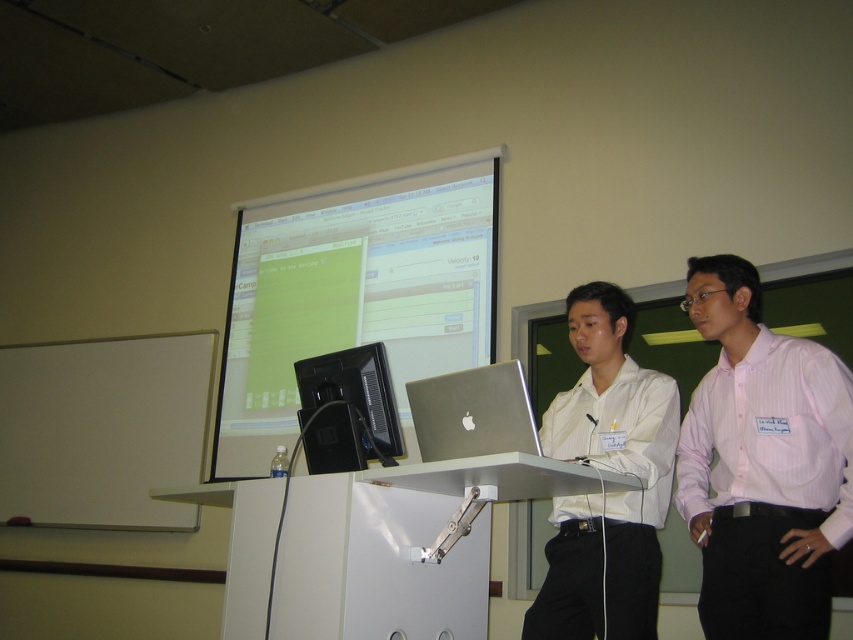
Can you confirm if pink striped shirt at center right is positioned below white glossy shirt at center?

Incorrect, pink striped shirt at center right is not positioned below white glossy shirt at center.

This screenshot has width=853, height=640. What do you see at coordinates (762, 464) in the screenshot? I see `pink striped shirt at center right` at bounding box center [762, 464].

Who is more forward, (788,502) or (639,596)?

Point (788,502) is in front.

I want to click on pink striped shirt at center right, so tap(762, 464).

Which is above, matte white projection screen at upper center or pink striped shirt at center right?

matte white projection screen at upper center is higher up.

Does point (338, 307) come farther from viewer compared to point (733, 316)?

Yes, point (338, 307) is behind point (733, 316).

The image size is (853, 640). Identify the location of matte white projection screen at upper center. (355, 292).

Can you confirm if white glossy shirt at center is shorter than black glossy monitor at center?

No, white glossy shirt at center is not shorter than black glossy monitor at center.

What do you see at coordinates (607, 468) in the screenshot?
I see `white glossy shirt at center` at bounding box center [607, 468].

Identify the location of white glossy shirt at center. This screenshot has width=853, height=640. (607, 468).